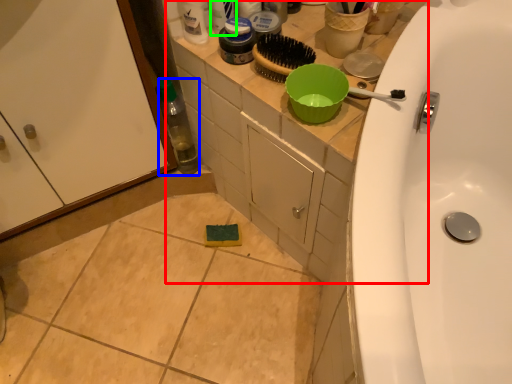
Question: Based on their relative distances, which object is farther from counter top (highlighted by a red box)? Choose from bottle (highlighted by a blue box) and toiletry (highlighted by a green box).

Choices:
 (A) bottle
 (B) toiletry

Answer: (B)